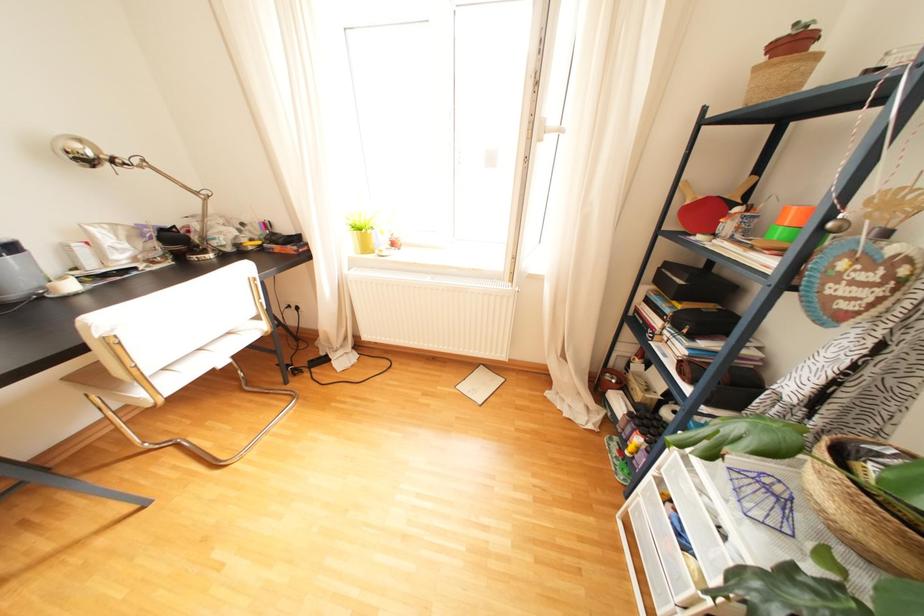
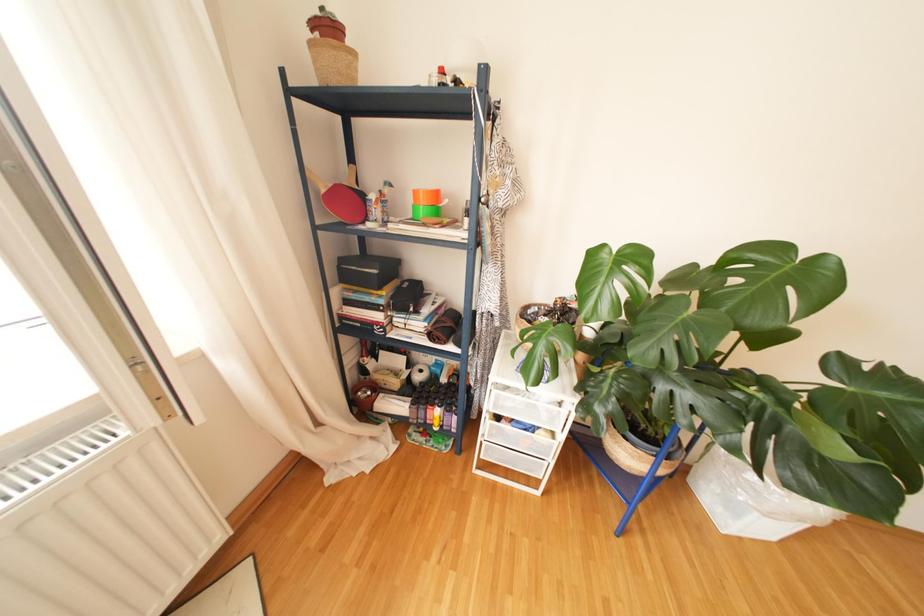
The first image is from the beginning of the video and the second image is from the end. How did the camera likely rotate when shooting the video?

The camera's rotation is toward right-down.